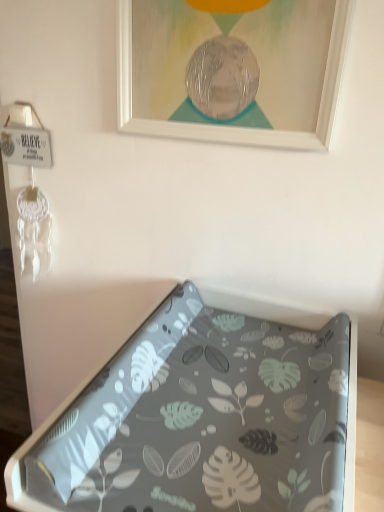
Question: From their relative heights in the image, would you say white matte picture frame at upper center is taller or shorter than gray leaf-patterned tray at center?

Choices:
 (A) tall
 (B) short

Answer: (A)

Question: From the image's perspective, is white matte picture frame at upper center located above or below gray leaf-patterned tray at center?

Choices:
 (A) below
 (B) above

Answer: (B)

Question: Is white matte picture frame at upper center inside or outside of gray leaf-patterned tray at center?

Choices:
 (A) inside
 (B) outside

Answer: (B)

Question: From the image's perspective, is gray leaf-patterned tray at center positioned above or below white matte picture frame at upper center?

Choices:
 (A) below
 (B) above

Answer: (A)

Question: Is gray leaf-patterned tray at center situated inside white matte picture frame at upper center or outside?

Choices:
 (A) outside
 (B) inside

Answer: (A)

Question: Considering the positions of gray leaf-patterned tray at center and white matte picture frame at upper center in the image, is gray leaf-patterned tray at center wider or thinner than white matte picture frame at upper center?

Choices:
 (A) wide
 (B) thin

Answer: (A)

Question: Considering the positions of gray leaf-patterned tray at center and white matte picture frame at upper center in the image, is gray leaf-patterned tray at center taller or shorter than white matte picture frame at upper center?

Choices:
 (A) tall
 (B) short

Answer: (B)